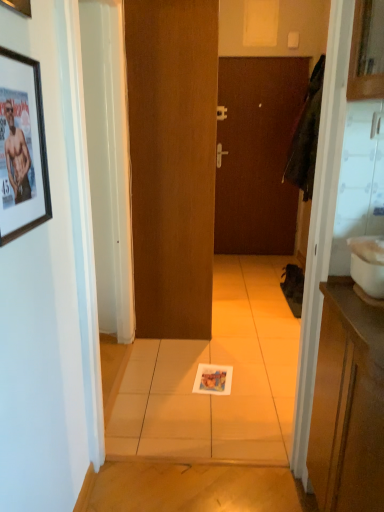
The height and width of the screenshot is (512, 384). Find the location of `vacant point above brown matte door at center, positioned as the second door in left-to-right order (from a real-world perspective)`. vacant point above brown matte door at center, positioned as the second door in left-to-right order (from a real-world perspective) is located at coordinates 261,59.